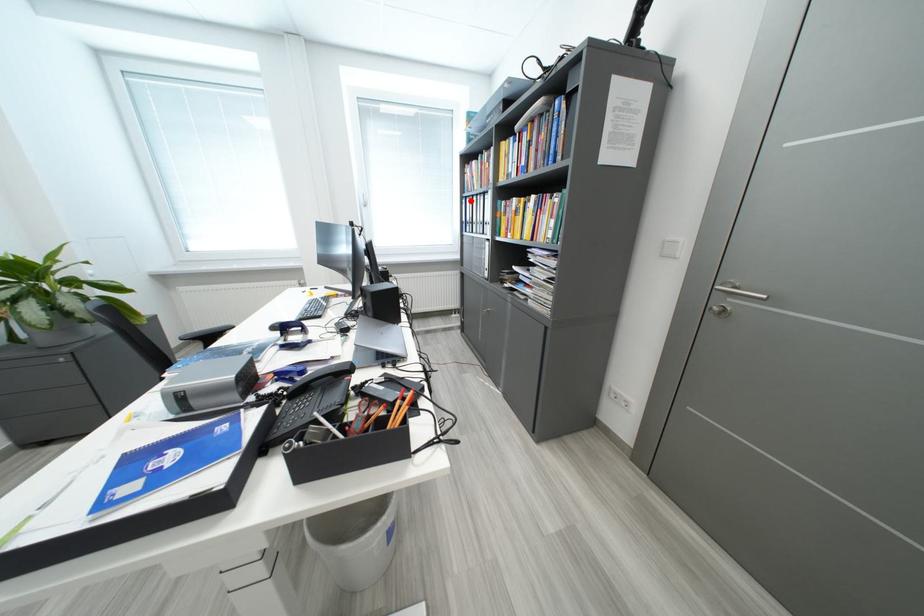
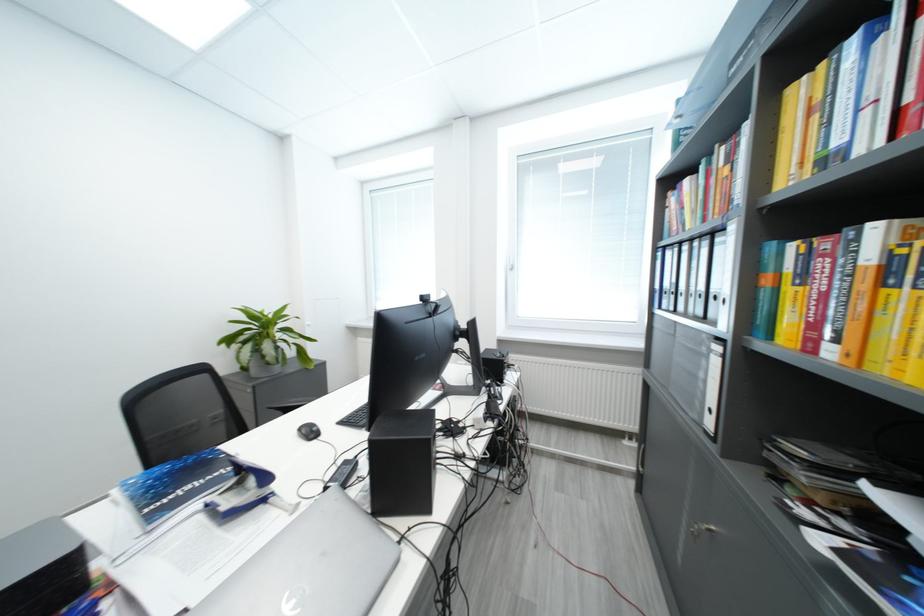
Question: I am providing you with two images of the same scene from different viewpoints. A red point is shown in image1. For the corresponding object point in image2, is it positioned nearer or farther from the camera?

Choices:
 (A) Nearer
 (B) Farther

Answer: (B)